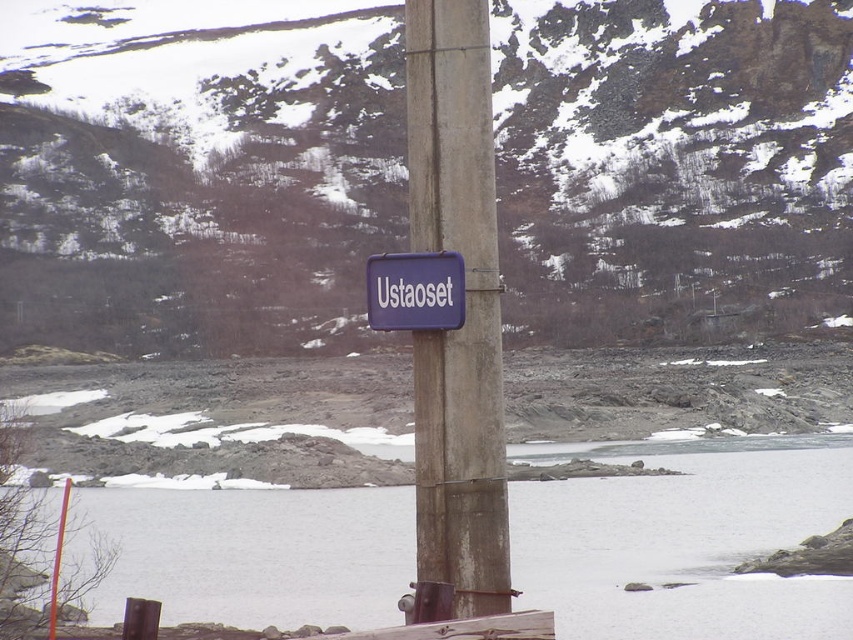
Question: In this image, where is matte gray rock at center located relative to purple matte sign at center?

Choices:
 (A) above
 (B) below

Answer: (A)

Question: Which is farther from the matte gray rock at center?

Choices:
 (A) white ice at lower center
 (B) purple matte sign at center
 (C) rusty concrete pole at center

Answer: (B)

Question: Can you confirm if matte gray rock at center is positioned to the left of purple matte sign at center?

Choices:
 (A) no
 (B) yes

Answer: (A)

Question: Which object appears closest to the camera in this image?

Choices:
 (A) rusty concrete pole at center
 (B) matte gray rock at center
 (C) white ice at lower center
 (D) purple matte sign at center

Answer: (A)

Question: Is matte gray rock at center bigger than white ice at lower center?

Choices:
 (A) no
 (B) yes

Answer: (B)

Question: Which is farther from the white ice at lower center?

Choices:
 (A) rusty concrete pole at center
 (B) purple matte sign at center
 (C) matte gray rock at center

Answer: (C)